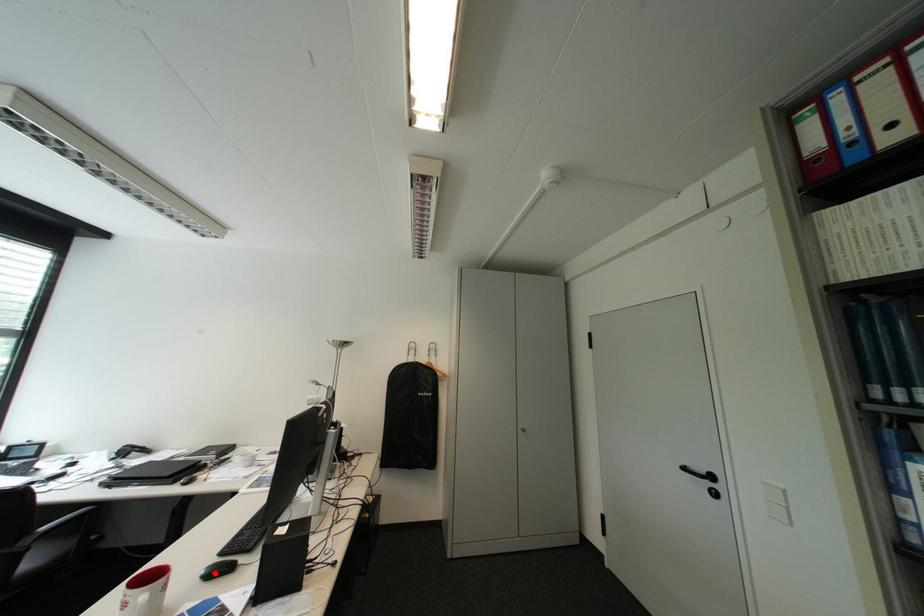
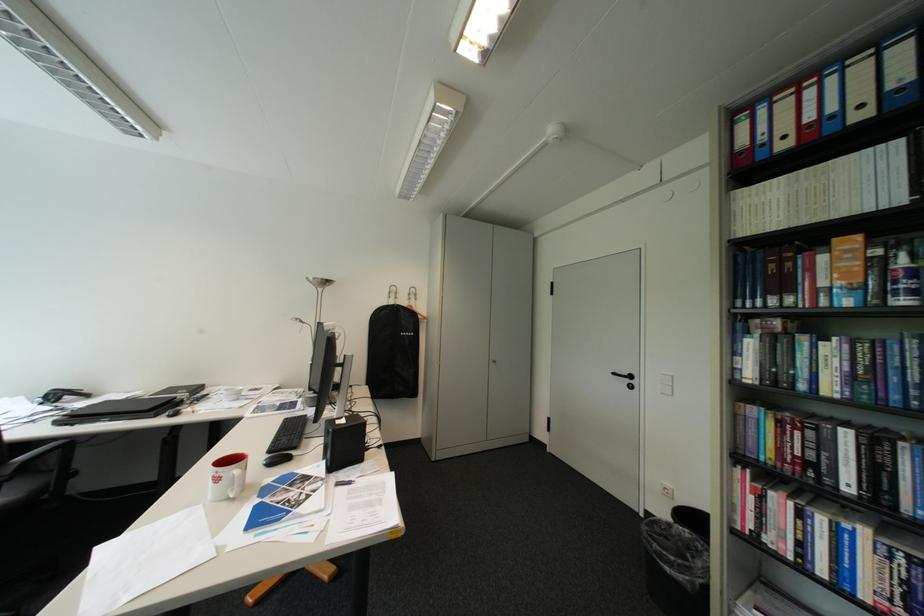
Find the pixel in the second image that matches the highlighted location in the first image.

(276, 463)